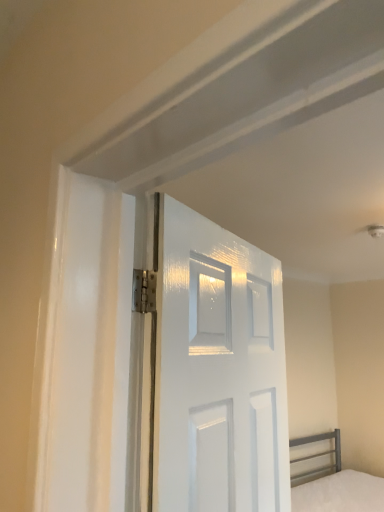
Question: From their relative heights in the image, would you say white matte bed at lower right is taller or shorter than white glossy door at center?

Choices:
 (A) tall
 (B) short

Answer: (B)

Question: In terms of size, does white matte bed at lower right appear bigger or smaller than white glossy door at center?

Choices:
 (A) small
 (B) big

Answer: (B)

Question: Is white matte bed at lower right in front of or behind white glossy door at center in the image?

Choices:
 (A) behind
 (B) front

Answer: (A)

Question: Looking at the image, does white glossy door at center seem bigger or smaller compared to white matte bed at lower right?

Choices:
 (A) big
 (B) small

Answer: (B)

Question: Is point pyautogui.click(x=283, y=406) positioned closer to the camera than point pyautogui.click(x=334, y=490)?

Choices:
 (A) farther
 (B) closer

Answer: (B)

Question: Looking at their shapes, would you say white glossy door at center is wider or thinner than white matte bed at lower right?

Choices:
 (A) thin
 (B) wide

Answer: (A)

Question: Do you think white glossy door at center is within white matte bed at lower right, or outside of it?

Choices:
 (A) inside
 (B) outside

Answer: (B)